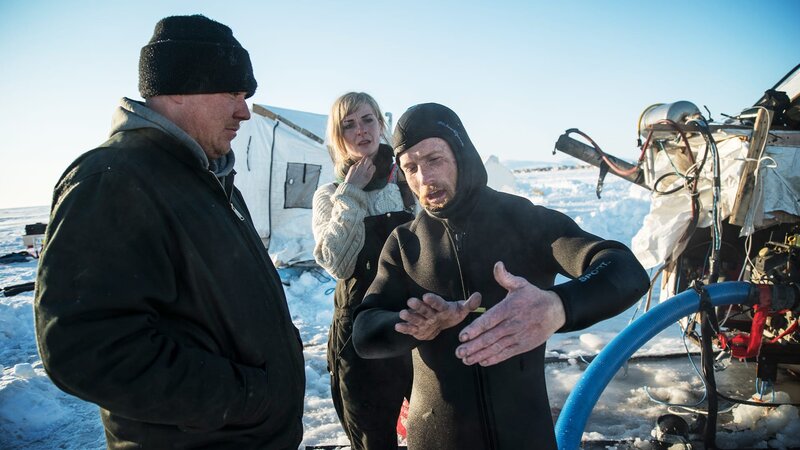
This screenshot has width=800, height=450. I want to click on window, so click(298, 180).